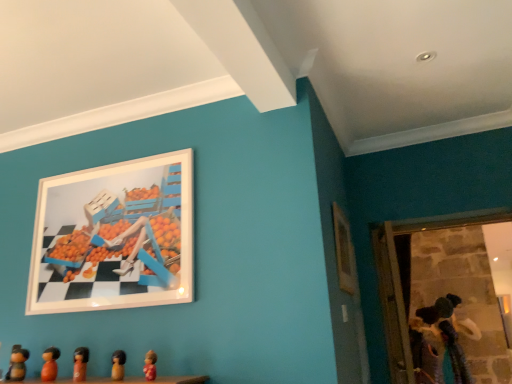
What do you see at coordinates (50, 364) in the screenshot? I see `wooden figurine at lower left, the fourth toy positioned from the top` at bounding box center [50, 364].

At what (x,y) coordinates should I click in order to perform the action: click on matte pink figurine at lower center, positioned as the first toy in top-to-bottom order. Please return your answer as a coordinate pair (x, y). The image size is (512, 384). Looking at the image, I should click on (150, 365).

What do you see at coordinates (123, 380) in the screenshot?
I see `wooden figurines at lower center` at bounding box center [123, 380].

What do you see at coordinates (344, 252) in the screenshot? I see `wooden picture frame at upper right, which is the 1th picture frame from right to left` at bounding box center [344, 252].

Describe the element at coordinates (114, 237) in the screenshot. I see `white glossy picture frame at upper left, the second picture frame from the right` at that location.

The width and height of the screenshot is (512, 384). Describe the element at coordinates (118, 365) in the screenshot. I see `wooden figurine at lower center, placed as the fifth toy when sorted from back to front` at that location.

Find the location of a particular element. wooden figurine at lower left, which is the 3th toy from bottom to top is located at coordinates (50, 364).

Does wooden figurine at lower center, placed as the fifth toy when sorted from back to front, have a lesser width compared to wooden figurine at lower left, the 5th toy positioned from the front?

Yes.

From their relative heights in the image, would you say wooden figurine at lower center, which is the 2th toy from front to back, is taller or shorter than wooden figurine at lower left, the sixth toy viewed from the right?

Clearly, wooden figurine at lower center, which is the 2th toy from front to back, is shorter compared to wooden figurine at lower left, the sixth toy viewed from the right.

From a real-world perspective, count 3rd toys upward from the wooden figurine at lower center, acting as the 5th toy starting from the bottom, and point to it. Please provide its 2D coordinates.

[(17, 364)]

Is wooden figurine at lower center, the second toy from the top, positioned with its back to wooden figurine at lower left, the fifth toy when ordered from top to bottom?

No, wooden figurine at lower center, the second toy from the top, is not facing away from wooden figurine at lower left, the fifth toy when ordered from top to bottom.

Is velvet plush doll at lower right, which is the first toy from right to left, located outside matte pink figurine at lower center, positioned as the fifth toy in left-to-right order?

velvet plush doll at lower right, which is the first toy from right to left, lies outside matte pink figurine at lower center, positioned as the fifth toy in left-to-right order,'s area.

From a real-world perspective, which object stands above the other?

matte pink figurine at lower center, which is the first toy from front to back, from a real-world perspective.

Is velvet plush doll at lower right, which ranks as the 6th toy in left-to-right order, positioned before matte pink figurine at lower center, which is the second toy in right-to-left order?

No, it is behind matte pink figurine at lower center, which is the second toy in right-to-left order.

Can you confirm if velvet plush doll at lower right, which appears as the sixth toy when viewed from the top, is taller than matte pink figurine at lower center, positioned as the 6th toy in bottom-to-top order?

Indeed, velvet plush doll at lower right, which appears as the sixth toy when viewed from the top, has a greater height compared to matte pink figurine at lower center, positioned as the 6th toy in bottom-to-top order.

Would you say wooden figurine at lower left, the fourth toy positioned from the top, contains matte pink figurine at lower center, which is the second toy in right-to-left order?

No, matte pink figurine at lower center, which is the second toy in right-to-left order, is not a part of wooden figurine at lower left, the fourth toy positioned from the top.

Is wooden figurine at lower left, which is the 3th toy from bottom to top, bigger than matte pink figurine at lower center, positioned as the first toy in top-to-bottom order?

Yes.

In the scene shown: Which is more to the left, wooden figurine at lower left, positioned as the 5th toy in right-to-left order, or matte pink figurine at lower center, which is the first toy from front to back?

From the viewer's perspective, wooden figurine at lower left, positioned as the 5th toy in right-to-left order, appears more on the left side.

Is wooden figurine at lower left, marked as the second toy in a left-to-right arrangement, directly adjacent to matte pink figurine at lower center, positioned as the fifth toy in left-to-right order?

No, wooden figurine at lower left, marked as the second toy in a left-to-right arrangement, is not in contact with matte pink figurine at lower center, positioned as the fifth toy in left-to-right order.

Does matte orange figurine at lower left, the third toy from the left, lie in front of velvet plush doll at lower right, which ranks as the 6th toy in left-to-right order?

Yes, matte orange figurine at lower left, the third toy from the left, is closer to the viewer.

Consider the image. From the image's perspective, does matte orange figurine at lower left, the third toy from the left, appear lower than velvet plush doll at lower right, which ranks as the 6th toy in left-to-right order?

No.

Considering the positions of objects matte orange figurine at lower left, the third toy in the top-to-bottom sequence, and velvet plush doll at lower right, which ranks as the 6th toy in left-to-right order, in the image provided, who is more to the left, matte orange figurine at lower left, the third toy in the top-to-bottom sequence, or velvet plush doll at lower right, which ranks as the 6th toy in left-to-right order,?

matte orange figurine at lower left, the third toy in the top-to-bottom sequence.

From a real-world perspective, is matte orange figurine at lower left, the 4th toy when ordered from right to left, located higher than velvet plush doll at lower right, which appears as the sixth toy when viewed from the top?

Yes, from a real-world perspective, matte orange figurine at lower left, the 4th toy when ordered from right to left, is on top of velvet plush doll at lower right, which appears as the sixth toy when viewed from the top.

Considering the sizes of wooden figurine at lower left, which is the 3th toy from bottom to top, and wooden figurines at lower center in the image, is wooden figurine at lower left, which is the 3th toy from bottom to top, wider or thinner than wooden figurines at lower center?

In the image, wooden figurine at lower left, which is the 3th toy from bottom to top, appears to be more narrow than wooden figurines at lower center.

Is wooden figurine at lower left, which is counted as the 4th toy, starting from the front, placed right next to wooden figurines at lower center?

No, wooden figurine at lower left, which is counted as the 4th toy, starting from the front, is not making contact with wooden figurines at lower center.

Is wooden figurine at lower left, the fourth toy positioned from the top, facing towards wooden figurines at lower center?

No, wooden figurine at lower left, the fourth toy positioned from the top, is not facing towards wooden figurines at lower center.

The image size is (512, 384). What are the coordinates of `table located underneath the wooden figurine at lower left, the fourth toy positioned from the top (from a real-world perspective)` in the screenshot? It's located at (123, 380).

Is matte pink figurine at lower center, positioned as the 6th toy in bottom-to-top order, to the left of wooden figurine at lower left, the 5th toy positioned from the front, from the viewer's perspective?

No.

Considering the sizes of objects matte pink figurine at lower center, which is the second toy in right-to-left order, and wooden figurine at lower left, the sixth toy viewed from the right, in the image provided, who is smaller, matte pink figurine at lower center, which is the second toy in right-to-left order, or wooden figurine at lower left, the sixth toy viewed from the right,?

Smaller between the two is matte pink figurine at lower center, which is the second toy in right-to-left order.

Who is taller, matte pink figurine at lower center, positioned as the 6th toy in bottom-to-top order, or wooden figurine at lower left, which ranks as the 2th toy in back-to-front order?

wooden figurine at lower left, which ranks as the 2th toy in back-to-front order, is taller.

You are a GUI agent. You are given a task and a screenshot of the screen. Output one action in this format:
    pyautogui.click(x=<x>, y=<y>)
    Task: Click on the toy that is the 4th object directly below the wooden figurine at lower left, the 5th toy positioned from the front (from a real-world perspective)
    
    Given the screenshot: What is the action you would take?
    pyautogui.click(x=150, y=365)

Is velvet plush doll at lower right, which appears as the sixth toy when viewed from the top, further to camera compared to wooden figurine at lower center, acting as the 5th toy starting from the bottom?

That is True.

Considering the relative sizes of velvet plush doll at lower right, which is the sixth toy in front-to-back order, and wooden figurine at lower center, acting as the 4th toy starting from the left, in the image provided, is velvet plush doll at lower right, which is the sixth toy in front-to-back order, bigger than wooden figurine at lower center, acting as the 4th toy starting from the left,?

Correct, velvet plush doll at lower right, which is the sixth toy in front-to-back order, is larger in size than wooden figurine at lower center, acting as the 4th toy starting from the left.

Could you tell me if velvet plush doll at lower right, which appears as the sixth toy when viewed from the top, is turned towards wooden figurine at lower center, placed as the fifth toy when sorted from back to front?

Yes.

Where is `the 4th toy behind the wooden figurine at lower center, the 3th toy positioned from the right, counting from the anchor's position`? the 4th toy behind the wooden figurine at lower center, the 3th toy positioned from the right, counting from the anchor's position is located at coordinates (447, 338).

Locate an element on the screen. toy that is the 3rd one when counting downward from the wooden figurine at lower center, placed as the fifth toy when sorted from back to front (from the image's perspective) is located at coordinates pyautogui.click(x=17, y=364).

From the velvet plush doll at lower right, the first toy when ordered from bottom to top, count 5th toys forward and point to it. Please provide its 2D coordinates.

[(150, 365)]

Which object lies further to the anchor point wooden figurine at lower left, the fourth toy positioned from the top, matte pink figurine at lower center, positioned as the first toy in top-to-bottom order, or wooden figurine at lower left, the sixth toy viewed from the right?

matte pink figurine at lower center, positioned as the first toy in top-to-bottom order, is positioned further to the anchor wooden figurine at lower left, the fourth toy positioned from the top.

Looking at the image, which one is located closer to white glossy picture frame at upper left, the first picture frame when ordered from left to right, wooden figurines at lower center or wooden figurine at lower left, which ranks as the 2th toy in back-to-front order?

wooden figurines at lower center lies closer to white glossy picture frame at upper left, the first picture frame when ordered from left to right, than the other object.

Which object lies nearer to the anchor point velvet plush doll at lower right, which appears as the sixth toy when viewed from the top, wooden picture frame at upper right, which is the 1th picture frame from right to left, or matte pink figurine at lower center, which is the first toy from front to back?

The object closer to velvet plush doll at lower right, which appears as the sixth toy when viewed from the top, is wooden picture frame at upper right, which is the 1th picture frame from right to left.

When comparing their distances from wooden figurine at lower left, the 1th toy positioned from the left, does matte pink figurine at lower center, positioned as the first toy in top-to-bottom order, or velvet plush doll at lower right, which appears as the sixth toy when viewed from the top, seem closer?

The object closer to wooden figurine at lower left, the 1th toy positioned from the left, is matte pink figurine at lower center, positioned as the first toy in top-to-bottom order.

Looking at the image, which one is located further to white glossy picture frame at upper left, the first picture frame when ordered from left to right, wooden figurine at lower left, the fourth toy positioned from the top, or wooden figurines at lower center?

wooden figurines at lower center.

Looking at the image, which one is located closer to wooden figurine at lower left, acting as the second toy starting from the bottom, white glossy picture frame at upper left, the first picture frame when ordered from left to right, or matte orange figurine at lower left, the 4th toy when ordered from right to left?

matte orange figurine at lower left, the 4th toy when ordered from right to left, lies closer to wooden figurine at lower left, acting as the second toy starting from the bottom, than the other object.

Based on their spatial positions, is matte orange figurine at lower left, the third toy in the top-to-bottom sequence, or wooden picture frame at upper right, which is the 2th picture frame from left to right, closer to wooden figurine at lower left, the sixth toy viewed from the right?

matte orange figurine at lower left, the third toy in the top-to-bottom sequence, is closer to wooden figurine at lower left, the sixth toy viewed from the right.

Based on the photo, estimate the real-world distances between objects in this image. Which object is further from wooden figurine at lower left, the fifth toy when ordered from top to bottom, velvet plush doll at lower right, which appears as the sixth toy when viewed from the top, or white glossy picture frame at upper left, the second picture frame from the right?

Based on the image, velvet plush doll at lower right, which appears as the sixth toy when viewed from the top, appears to be further to wooden figurine at lower left, the fifth toy when ordered from top to bottom.

You are a GUI agent. You are given a task and a screenshot of the screen. Output one action in this format:
    pyautogui.click(x=<x>, y=<y>)
    Task: Click on the picture frame between matte orange figurine at lower left, the third toy from the left, and wooden picture frame at upper right, which is the 2th picture frame from left to right, in the horizontal direction
    
    Given the screenshot: What is the action you would take?
    pyautogui.click(x=114, y=237)

You are a GUI agent. You are given a task and a screenshot of the screen. Output one action in this format:
    pyautogui.click(x=<x>, y=<y>)
    Task: Click on the picture frame between wooden figurine at lower left, positioned as the 5th toy in right-to-left order, and wooden picture frame at upper right, which is the 2th picture frame from left to right, in the horizontal direction
    This screenshot has height=384, width=512.
    Given the screenshot: What is the action you would take?
    pyautogui.click(x=114, y=237)

At what (x,y) coordinates should I click in order to perform the action: click on table situated between wooden figurine at lower left, which ranks as the 2th toy in back-to-front order, and velvet plush doll at lower right, arranged as the 1th toy when viewed from the back, from left to right. Please return your answer as a coordinate pair (x, y). Looking at the image, I should click on (123, 380).

Locate an element on the screen. toy between wooden figurines at lower center and wooden figurine at lower center, the 3th toy positioned from the right, from front to back is located at coordinates (150, 365).